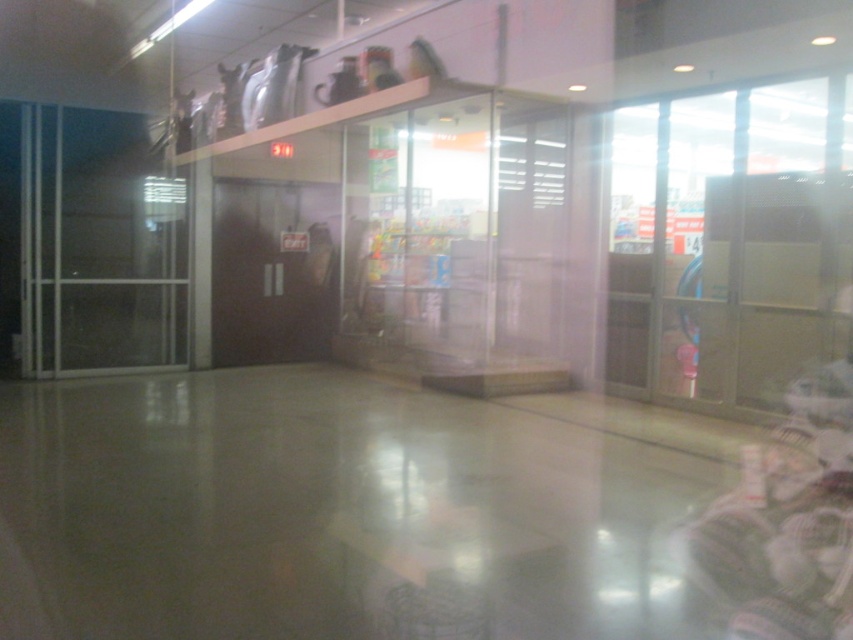
You are a delivery person trying to enter the building through the doors. The transparent plastic glass door at right is closer to you than the transparent glass door at left. Which door should you approach first to enter?

You should approach the transparent plastic glass door at right first because it is closer to you than the transparent glass door at left.

You are a delivery person trying to enter the store through the doors. The transparent plastic glass door at right and the transparent glass door at left are both unlocked. Which door should you push to enter?

The transparent plastic glass door at right is positioned on the right side of transparent glass door at left, so you should push the transparent plastic glass door at right to enter since it is the right door in the pair.

You are a delivery person carrying a large box that is 1 meter wide. You need to enter the building through either the transparent plastic glass door at right or the transparent glass door at left. Which door should you choose to ensure your box fits through?

You should choose the transparent glass door at left because it has a greater width compared to the transparent plastic glass door at right, which is narrower. Since your box is 1 meter wide, the wider door will accommodate it better.